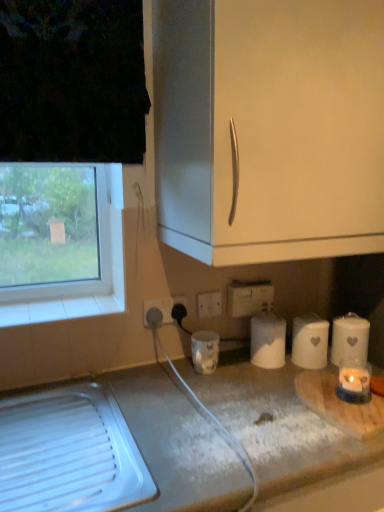
Locate an element on the screen. free space to the left of wooden cutting board at lower right is located at coordinates (248, 407).